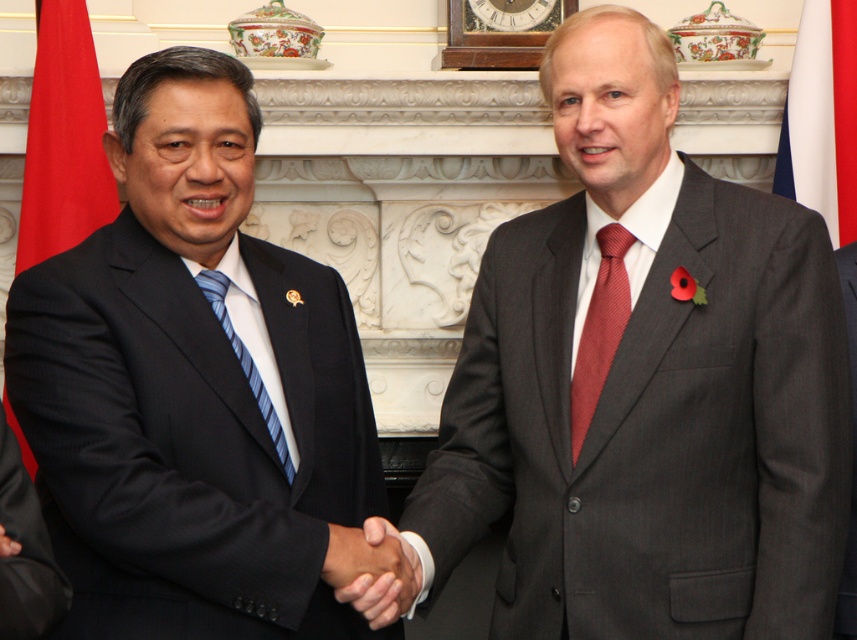
You are attending an international conference and notice two flags displayed behind the speakers. The red fabric flag at left and the white fabric flag at right. Which flag is positioned closer to the front of the stage?

The red fabric flag at left is closer to the viewer than the white fabric flag at right, so the red fabric flag at left is positioned closer to the front of the stage.

Where is the black smooth hand at center located in the image?

The black smooth hand at center is located at point coordinates of 0.892 on the x axis and 0.435 on the y axis.

Based on the photo, you are a photographer setting up for a formal portrait. You need to ensure that the black smooth hand at center and the red silk tie at center are both visible in the frame. Given their relative positions, which object should you adjust your camera angle to focus on first to ensure both are in the shot?

The black smooth hand at center is not as tall as the red silk tie at center, so you should focus on the red silk tie at center first to ensure both are visible in the frame.